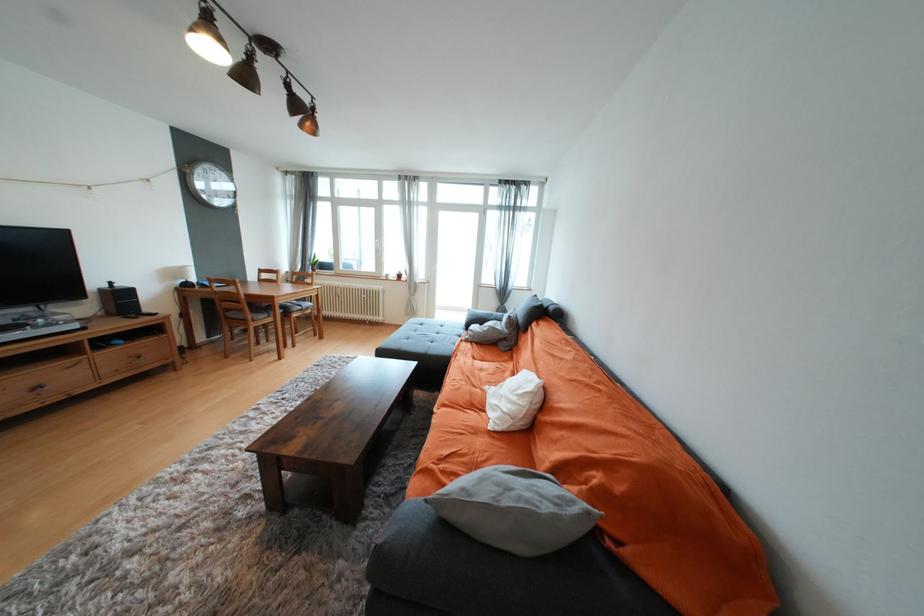
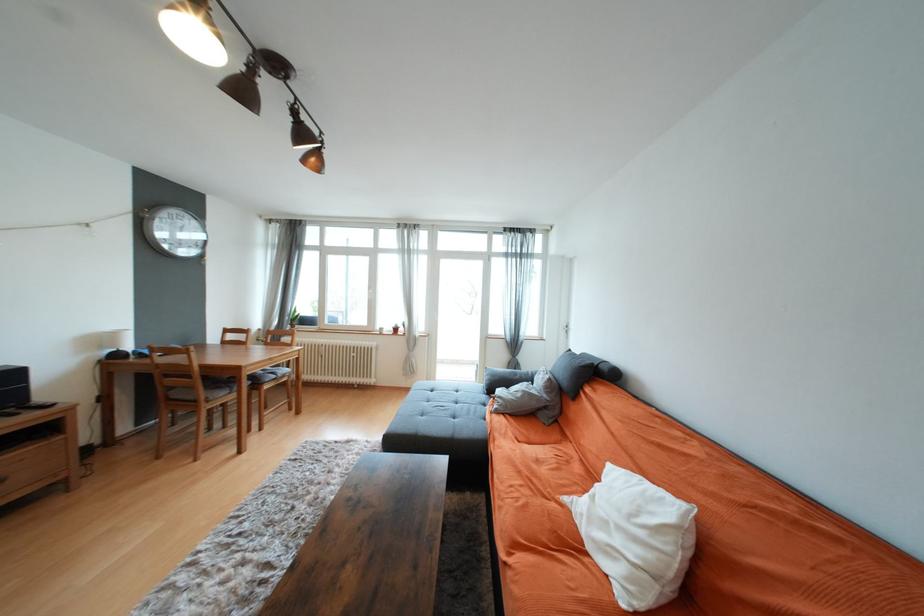
Where in the second image is the point corresponding to [313,126] from the first image?

(319, 161)